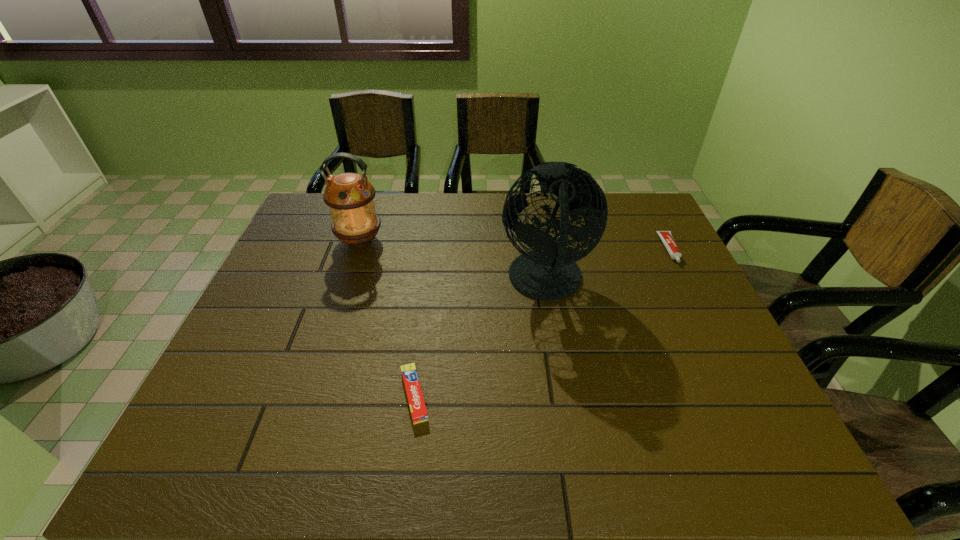
Find the location of a particular element. vacant area located on the front-facing side of the tallest object is located at coordinates (368, 282).

I want to click on vacant space located on the left of the third shortest object, so click(x=307, y=240).

Where is `blank space located 0.330m at the nozzle of the taller toothpaste`? blank space located 0.330m at the nozzle of the taller toothpaste is located at coordinates (724, 355).

I want to click on free space located 0.140m on the right of the nearer toothpaste, so click(495, 395).

You are a GUI agent. You are given a task and a screenshot of the screen. Output one action in this format:
    pyautogui.click(x=<x>, y=<y>)
    Task: Click on the object located in the far edge section of the desktop
    
    Given the screenshot: What is the action you would take?
    pyautogui.click(x=350, y=196)

What are the coordinates of `object positioned at the left edge` in the screenshot? It's located at coord(350,196).

This screenshot has width=960, height=540. Identify the location of object at the right edge. (666, 236).

I want to click on object present at the far left corner, so click(x=350, y=196).

Find the location of `blank space at the far edge`. blank space at the far edge is located at coordinates (505, 232).

Where is `vacant area at the near edge of the desktop`? This screenshot has height=540, width=960. vacant area at the near edge of the desktop is located at coordinates (318, 443).